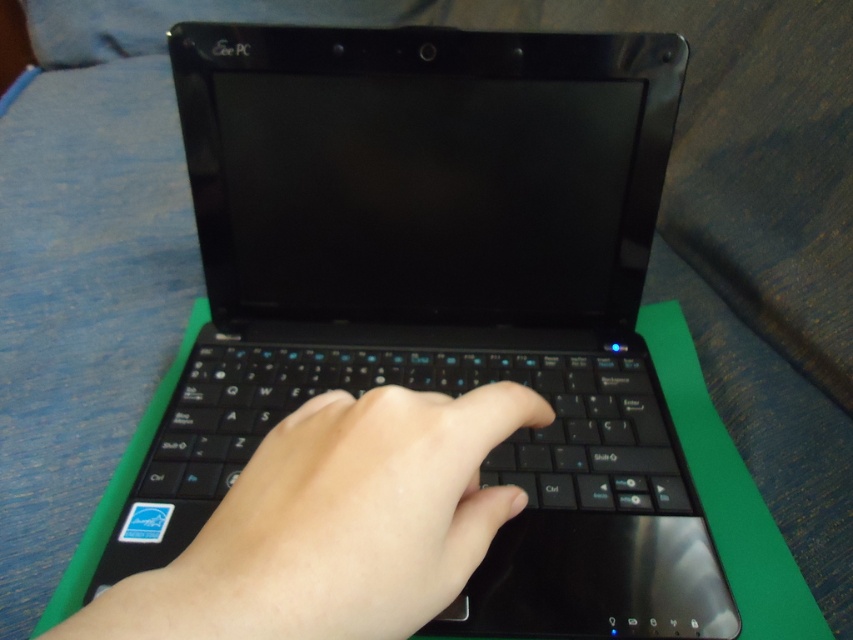
Based on the photo, you are designing a protective sleeve for the black matte keyboard at center. The sleeve must accommodate the matte black hand at center when it interacts with the keyboard. Based on the image, will the sleeve need to have extra space for the hand, or can it be snug around the keyboard alone?

The matte black hand at center is thinner than the black matte keyboard at center, so the sleeve can be snug around the keyboard alone without extra space for the hand.

You are a virtual assistant trying to determine the position of the objects in the image. Given that the scene includes a matte black hand at center and a black matte keyboard at center, which object is positioned to the right?

The black matte keyboard at center is to the right of the matte black hand at center.

From the picture: You are designing a new laptop case that needs to accommodate both the matte black hand at center and the black matte keyboard at center. Based on their sizes, which object should the case prioritize in terms of space allocation?

The case should prioritize space allocation for the black matte keyboard at center since it is larger than the matte black hand at center according to the description.